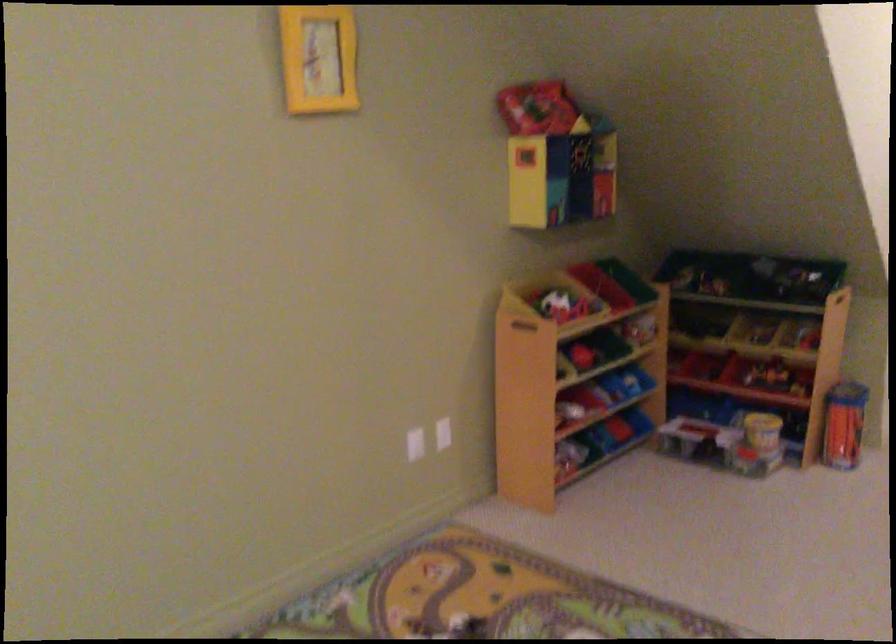
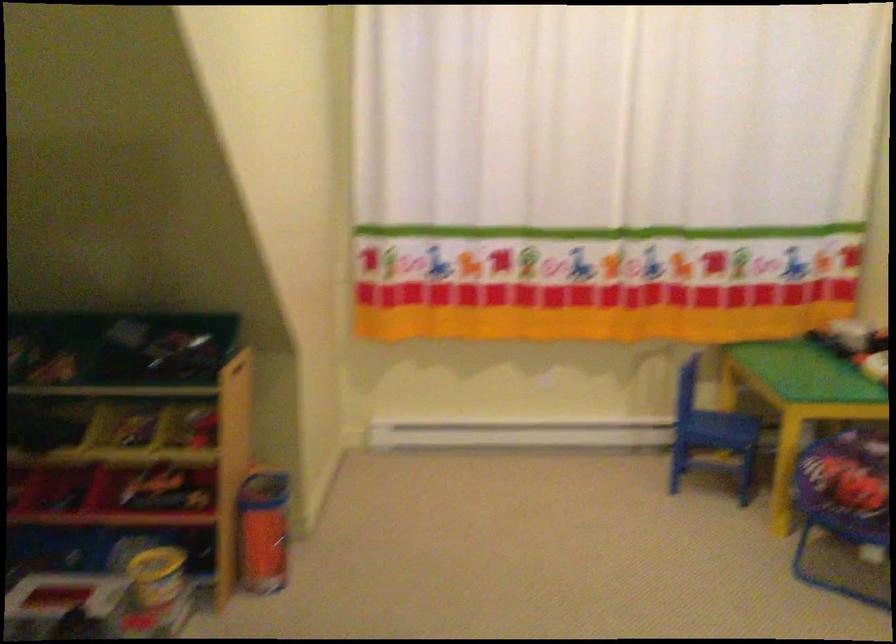
The point at (761, 430) is marked in the first image. Where is the corresponding point in the second image?

(156, 576)